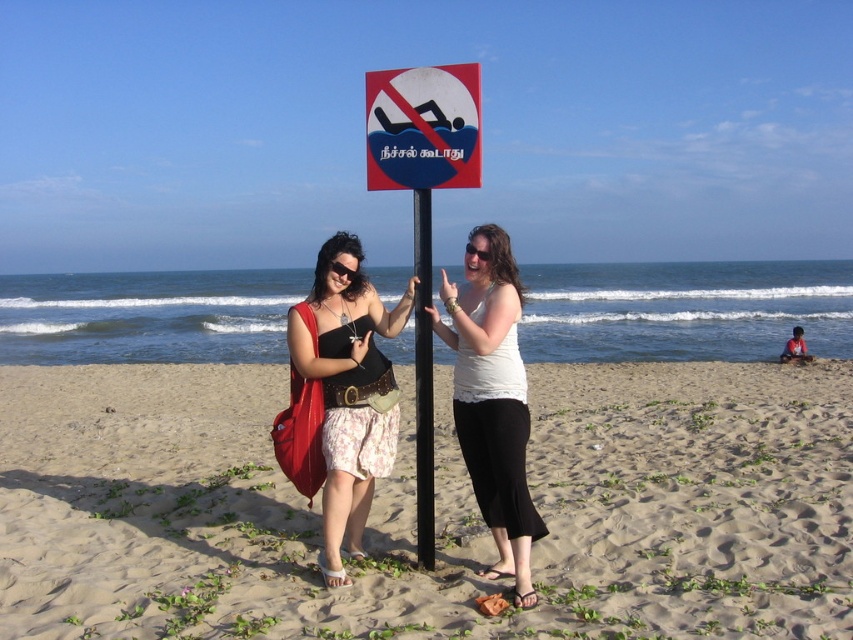
Question: Is sandy beach at lower center below black metal pole at center?

Choices:
 (A) yes
 (B) no

Answer: (A)

Question: Which of the following is the closest to the observer?

Choices:
 (A) blue plastic sign at center
 (B) matte black top at center
 (C) sandy beach at lower center

Answer: (C)

Question: Which point appears closest to the camera in this image?

Choices:
 (A) (425, 180)
 (B) (383, 460)

Answer: (A)

Question: Among these points, which one is farthest from the camera?

Choices:
 (A) (370, 477)
 (B) (70, 397)

Answer: (B)

Question: Is the position of matte black top at center more distant than that of metallic signboard at center?

Choices:
 (A) no
 (B) yes

Answer: (A)

Question: Is white cotton tank top at center to the right of metallic signboard at center from the viewer's perspective?

Choices:
 (A) yes
 (B) no

Answer: (A)